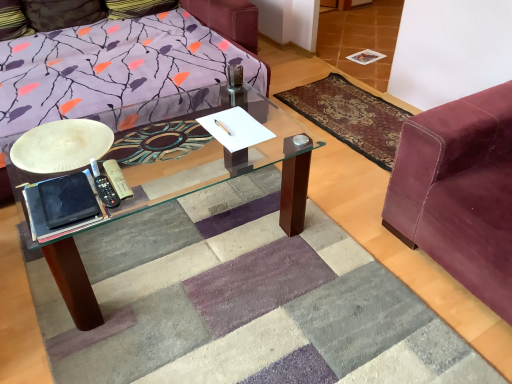
Question: Is velvet pillow at upper left to the left of velvet maroon couch at right from the viewer's perspective?

Choices:
 (A) yes
 (B) no

Answer: (A)

Question: Is velvet pillow at upper left smaller than velvet maroon couch at right?

Choices:
 (A) yes
 (B) no

Answer: (A)

Question: Is the position of velvet pillow at upper left more distant than that of velvet maroon couch at right?

Choices:
 (A) yes
 (B) no

Answer: (A)

Question: Does velvet pillow at upper left have a lesser width compared to velvet maroon couch at right?

Choices:
 (A) yes
 (B) no

Answer: (A)

Question: Can you confirm if velvet pillow at upper left is positioned to the right of velvet maroon couch at right?

Choices:
 (A) no
 (B) yes

Answer: (A)

Question: Would you say velvet-like burgundy mat at right is to the left or to the right of velvet maroon couch at right in the picture?

Choices:
 (A) left
 (B) right

Answer: (A)

Question: Relative to velvet maroon couch at right, is velvet-like burgundy mat at right in front or behind?

Choices:
 (A) behind
 (B) front

Answer: (A)

Question: From a real-world perspective, relative to velvet maroon couch at right, is velvet-like burgundy mat at right vertically above or below?

Choices:
 (A) above
 (B) below

Answer: (B)

Question: Is velvet-like burgundy mat at right situated inside velvet maroon couch at right or outside?

Choices:
 (A) outside
 (B) inside

Answer: (A)

Question: In terms of width, does velvet maroon couch at right look wider or thinner when compared to white matte plate at left?

Choices:
 (A) thin
 (B) wide

Answer: (B)

Question: Considering the positions of velvet maroon couch at right and white matte plate at left in the image, is velvet maroon couch at right taller or shorter than white matte plate at left?

Choices:
 (A) short
 (B) tall

Answer: (B)

Question: From the image's perspective, is velvet maroon couch at right positioned above or below white matte plate at left?

Choices:
 (A) below
 (B) above

Answer: (A)

Question: Choose the correct answer: Is velvet maroon couch at right inside white matte plate at left or outside it?

Choices:
 (A) inside
 (B) outside

Answer: (B)

Question: Is velvet maroon couch at right taller or shorter than velvet pillow at upper left?

Choices:
 (A) tall
 (B) short

Answer: (A)

Question: Considering the positions of velvet maroon couch at right and velvet pillow at upper left in the image, is velvet maroon couch at right bigger or smaller than velvet pillow at upper left?

Choices:
 (A) small
 (B) big

Answer: (B)